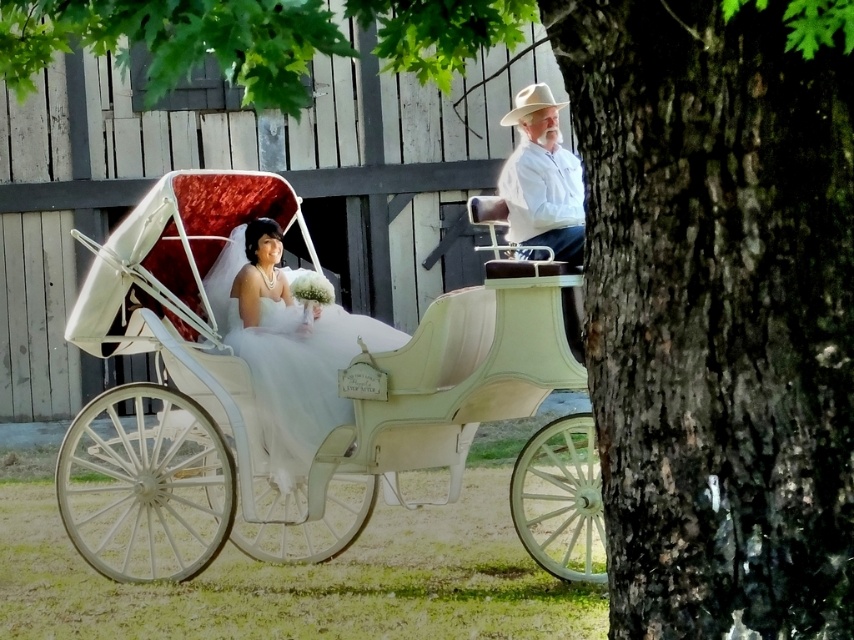
Question: Which object is farther from the camera taking this photo?

Choices:
 (A) dark brown bark at right
 (B) white matte hat at upper right
 (C) white satin dress at center
 (D) white felt cowboy hat at upper right

Answer: (C)

Question: Which object is positioned closest to the white satin dress at center?

Choices:
 (A) dark brown bark at right
 (B) white glossy horse cart at center
 (C) white felt cowboy hat at upper right
 (D) white matte hat at upper right

Answer: (B)

Question: From the image, what is the correct spatial relationship of dark brown bark at right in relation to white matte hat at upper right?

Choices:
 (A) above
 (B) below

Answer: (B)

Question: Is dark brown bark at right positioned in front of white matte hat at upper right?

Choices:
 (A) yes
 (B) no

Answer: (A)

Question: Which of the following is the farthest from the observer?

Choices:
 (A) white matte hat at upper right
 (B) dark brown bark at right
 (C) white glossy horse cart at center
 (D) white felt cowboy hat at upper right

Answer: (D)

Question: Observing the image, what is the correct spatial positioning of dark brown bark at right in reference to white glossy horse cart at center?

Choices:
 (A) above
 (B) below

Answer: (A)